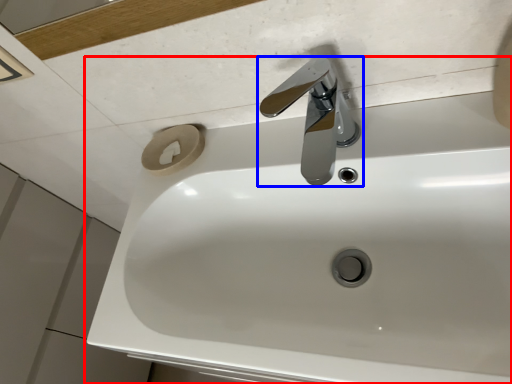
Question: Which of the following is the farthest to the observer, sink (highlighted by a red box) or tap (highlighted by a blue box)?

Choices:
 (A) sink
 (B) tap

Answer: (B)